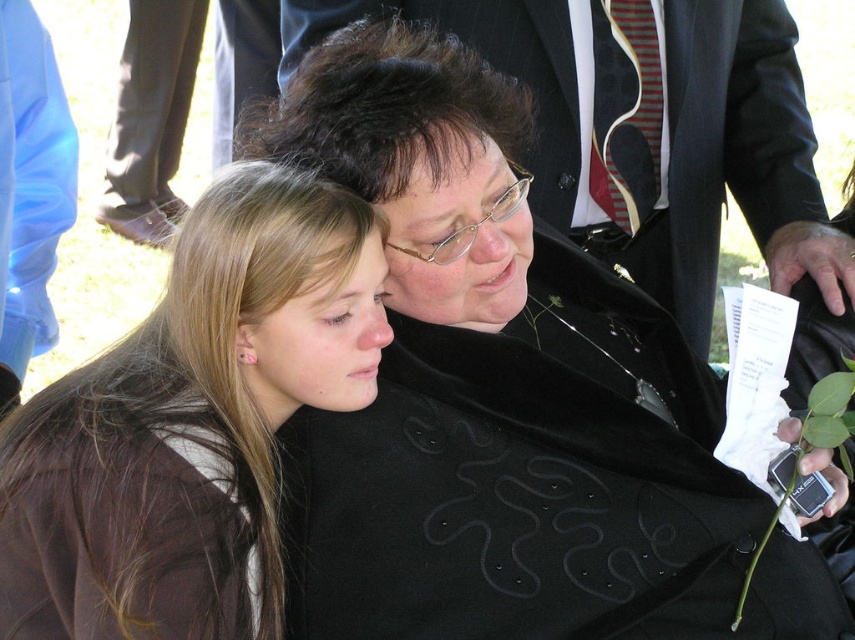
Question: Can you confirm if brown hair at left is positioned above matte black coat at center?

Choices:
 (A) yes
 (B) no

Answer: (B)

Question: Considering the real-world distances, which object is farthest from the matte black coat at center?

Choices:
 (A) dark brown silky hair at center
 (B) brown hair at left

Answer: (B)

Question: Which point is farther to the camera?

Choices:
 (A) (346, 408)
 (B) (342, 168)

Answer: (A)

Question: Can you confirm if brown hair at left is positioned below dark brown silky hair at center?

Choices:
 (A) no
 (B) yes

Answer: (B)

Question: From the image, what is the correct spatial relationship of brown hair at left in relation to dark brown silky hair at center?

Choices:
 (A) below
 (B) above

Answer: (A)

Question: Which of these objects is positioned farthest from the matte black coat at center?

Choices:
 (A) brown hair at left
 (B) dark brown silky hair at center

Answer: (A)